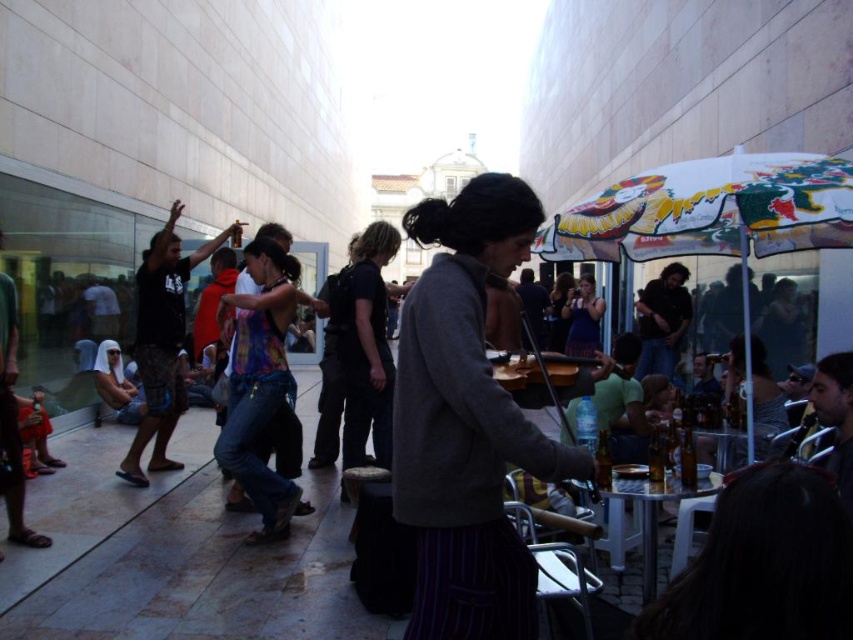
Based on the photo, you are attending an outdoor event and see the gray woolen sweater at center and the printed fabric umbrella at center. Which item is positioned higher?

The printed fabric umbrella at center is positioned higher than the gray woolen sweater at center.

In the scene shown: You are standing in the courtyard and want to locate the printed fabric umbrella at center. What are the coordinates where you should look?

The printed fabric umbrella at center is located at coordinates point (718, 211).

From the picture: You are organizing a small event in the courtyard and need to ensure there is enough space between the printed fabric umbrella at center and the wooden violin at center for attendees to walk comfortably. Given that the minimum required space for a walkway is 0.5 meters, can the current spacing accommodate this requirement?

The printed fabric umbrella at center has a larger size compared to wooden violin at center. However, the description does not provide specific measurements of the distance between them. Therefore, it is impossible to determine if the current spacing meets the 0.5 meters requirement without additional information.